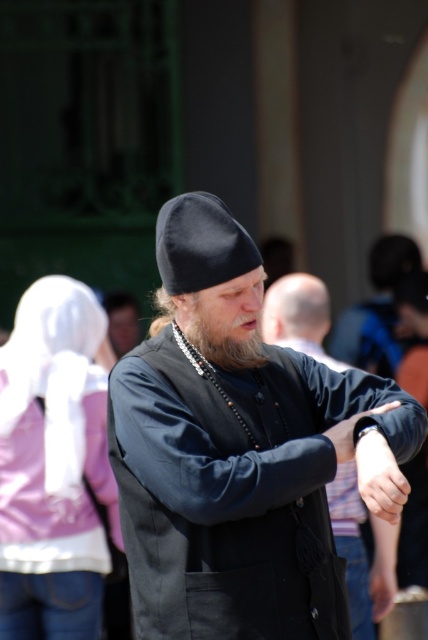
You are a photographer trying to capture a clear shot of the smooth leather wristwatch at center. However, the pink fabric headscarf at upper left is blocking your view. Based on their positions, can you determine if the headscarf is above or below the wristwatch?

The pink fabric headscarf at upper left is below the smooth leather wristwatch at center, so it is blocking the view from below and not above.